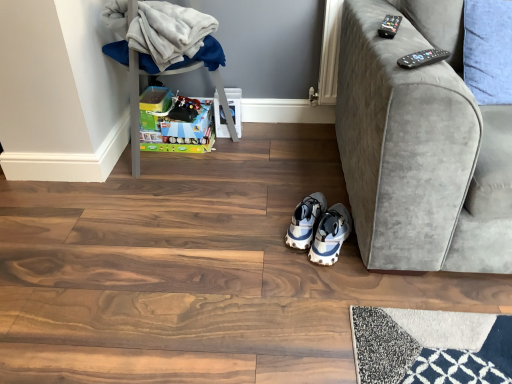
Question: Is there a large distance between matte plastic toy box at lower left and black plastic remote at upper right, the 1th remote viewed from the top?

Choices:
 (A) yes
 (B) no

Answer: (A)

Question: Considering the relative sizes of matte plastic toy box at lower left and black plastic remote at upper right, the 1th remote viewed from the top, in the image provided, is matte plastic toy box at lower left smaller than black plastic remote at upper right, the 1th remote viewed from the top,?

Choices:
 (A) yes
 (B) no

Answer: (B)

Question: Is black plastic remote at upper right, the second remote when ordered from bottom to top, surrounded by matte plastic toy box at lower left?

Choices:
 (A) no
 (B) yes

Answer: (A)

Question: From the image's perspective, does matte plastic toy box at lower left appear lower than black plastic remote at upper right, the second remote from the front?

Choices:
 (A) no
 (B) yes

Answer: (B)

Question: Is the position of matte plastic toy box at lower left more distant than that of black plastic remote at upper right, the 1th remote viewed from the top?

Choices:
 (A) yes
 (B) no

Answer: (A)

Question: Does matte plastic toy box at lower left have a lesser height compared to black plastic remote at upper right, the second remote when ordered from bottom to top?

Choices:
 (A) no
 (B) yes

Answer: (A)

Question: Does black plastic remote at upper right, the first remote when ordered from back to front, lie behind white fluffy blanket at upper left?

Choices:
 (A) yes
 (B) no

Answer: (B)

Question: From a real-world perspective, is black plastic remote at upper right, the second remote from the front, physically above white fluffy blanket at upper left?

Choices:
 (A) no
 (B) yes

Answer: (B)

Question: Is black plastic remote at upper right, the first remote when ordered from back to front, outside white fluffy blanket at upper left?

Choices:
 (A) no
 (B) yes

Answer: (B)

Question: Considering the relative sizes of black plastic remote at upper right, the first remote when ordered from back to front, and white fluffy blanket at upper left in the image provided, is black plastic remote at upper right, the first remote when ordered from back to front, wider than white fluffy blanket at upper left?

Choices:
 (A) no
 (B) yes

Answer: (A)

Question: Is black plastic remote at upper right, the second remote when ordered from bottom to top, not near white fluffy blanket at upper left?

Choices:
 (A) yes
 (B) no

Answer: (B)

Question: Is black plastic remote at upper right, the second remote when ordered from bottom to top, at the right side of white fluffy blanket at upper left?

Choices:
 (A) no
 (B) yes

Answer: (B)

Question: Is blue fabric pillow at upper right at the right side of black plastic remote at upper right, the 1th remote viewed from the top?

Choices:
 (A) no
 (B) yes

Answer: (B)